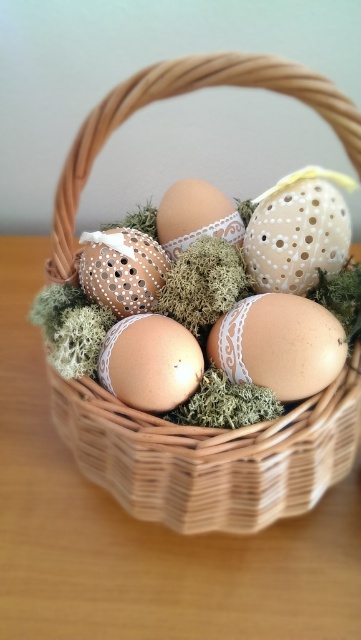
Is woven wood basket at center bigger than matte brown egg at center?

Yes.

Who is shorter, woven wood basket at center or matte brown egg at center?

matte brown egg at center

The width and height of the screenshot is (361, 640). Find the location of `woven wood basket at center`. woven wood basket at center is located at coordinates (210, 456).

Locate an element on the screen. This screenshot has width=361, height=640. matte white lace egg at center is located at coordinates (279, 344).

Is point (253, 349) closer to viewer compared to point (232, 205)?

Yes.

Locate an element on the screen. matte white lace egg at center is located at coordinates (279, 344).

Is wooden table at center shorter than matte brown egg at center?

No, wooden table at center is not shorter than matte brown egg at center.

This screenshot has height=640, width=361. Describe the element at coordinates (144, 531) in the screenshot. I see `wooden table at center` at that location.

Which is behind, point (168, 532) or point (115, 374)?

The point (168, 532) is more distant.

The width and height of the screenshot is (361, 640). What are the coordinates of `wooden table at center` in the screenshot? It's located at (144, 531).